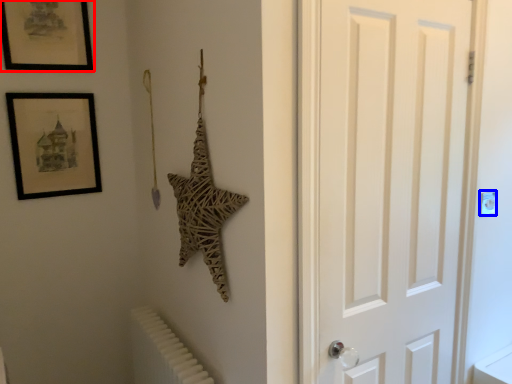
Question: Which of the following is the farthest to the observer, picture frame (highlighted by a red box) or light switch (highlighted by a blue box)?

Choices:
 (A) picture frame
 (B) light switch

Answer: (A)